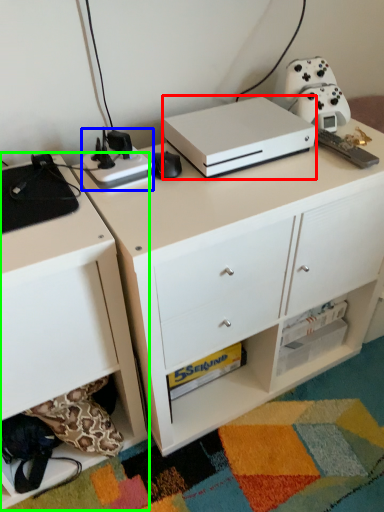
Question: Based on their relative distances, which object is farther from appliance (highlighted by a red box)? Choose from appliance (highlighted by a blue box) and chest of drawers (highlighted by a green box).

Choices:
 (A) appliance
 (B) chest of drawers

Answer: (B)